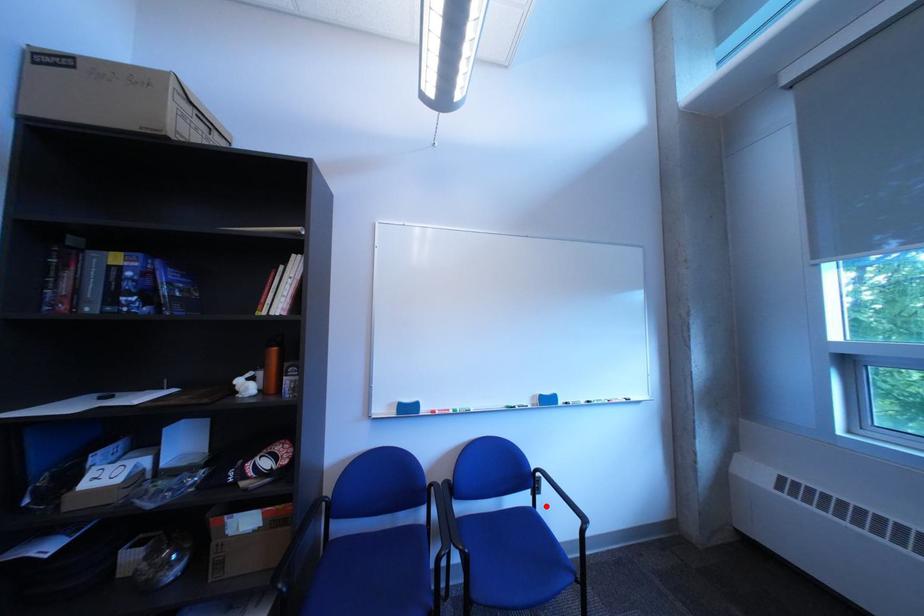
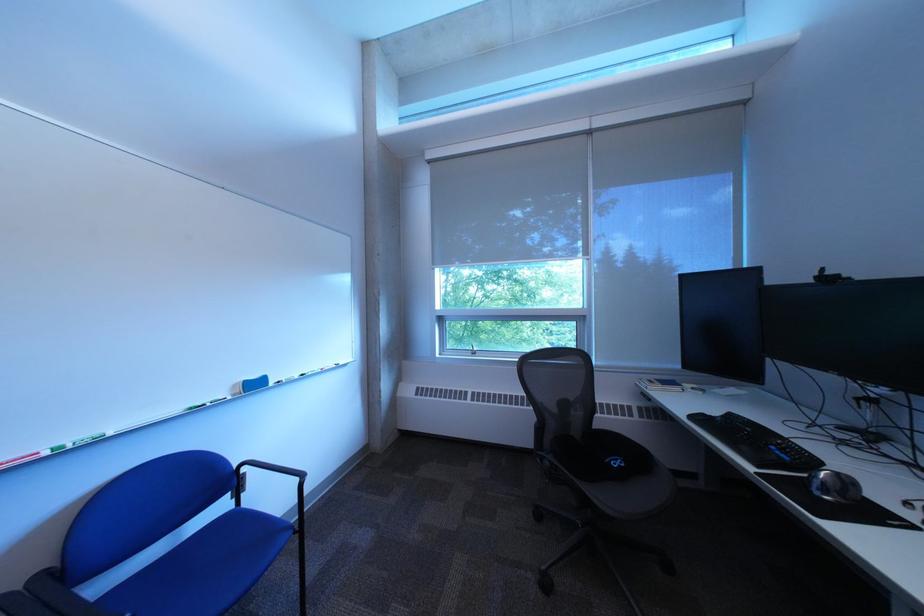
Where in the second image is the point corresponding to the highlighted location from the first image?

(248, 508)